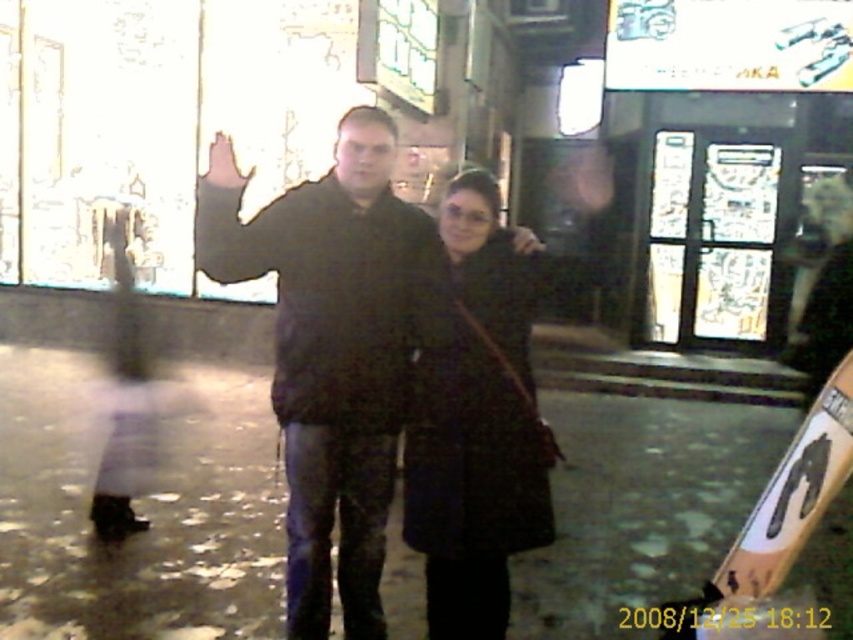
Question: Is the position of dark matte coat at center more distant than that of dark brown textured coat at center?

Choices:
 (A) no
 (B) yes

Answer: (A)

Question: Which point is closer to the camera taking this photo?

Choices:
 (A) (328, 550)
 (B) (463, 173)

Answer: (B)

Question: Is dark matte coat at center positioned before dark brown textured coat at center?

Choices:
 (A) no
 (B) yes

Answer: (B)

Question: Which of the following is the farthest from the observer?

Choices:
 (A) dark brown textured coat at center
 (B) dark matte coat at center

Answer: (A)

Question: Does dark matte coat at center appear over dark brown textured coat at center?

Choices:
 (A) yes
 (B) no

Answer: (A)